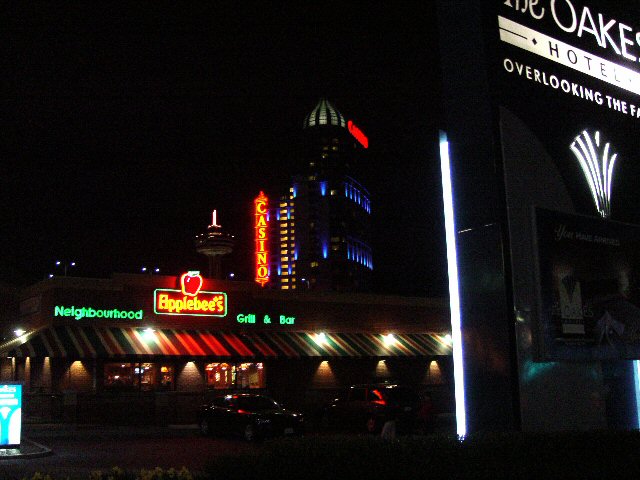
You are a GUI agent. You are given a task and a screenshot of the screen. Output one action in this format:
    pyautogui.click(x=<x>, y=<y>)
    Task: Click on the light
    
    Given the screenshot: What is the action you would take?
    pyautogui.click(x=456, y=250)